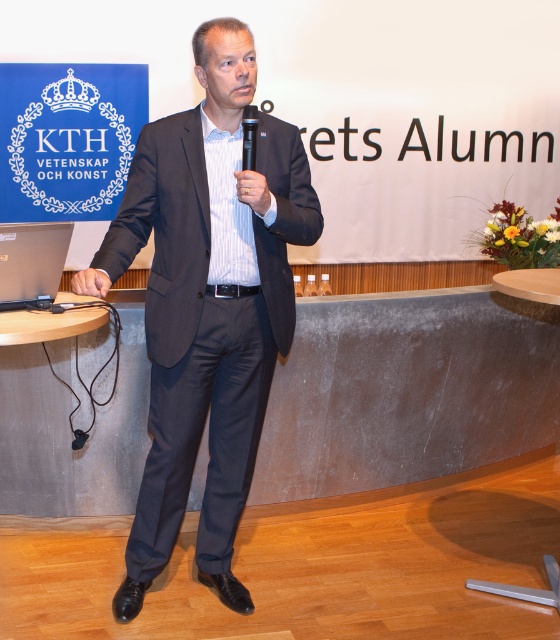
You are an attendee at a KTH event and need to present your slides. You see a silver metallic laptop at lower left and a black plastic microphone at center. Where should you place your presentation remote control if you want it to be near the microphone but not under the laptop?

You should place your presentation remote control near the black plastic microphone at center but above the silver metallic laptop at lower left since the laptop is below the microphone.

You are a photographer at the event and need to ensure that both the dark gray suit at center and the black plastic microphone at center are clearly visible in the photo. Given their sizes, which object should you focus on to ensure both are in frame without cropping?

The dark gray suit at center is larger in size than the black plastic microphone at center, so focusing on the larger dark gray suit at center will ensure both are in frame without cropping.

You are organizing a presentation and need to place a projector. The silver metallic laptop at lower left is where you will connect it. Where should you position the projector relative to the laptop to ensure it faces the screen?

The silver metallic laptop at lower left is located at point (31, 262), so you should position the projector behind the laptop to face the screen.